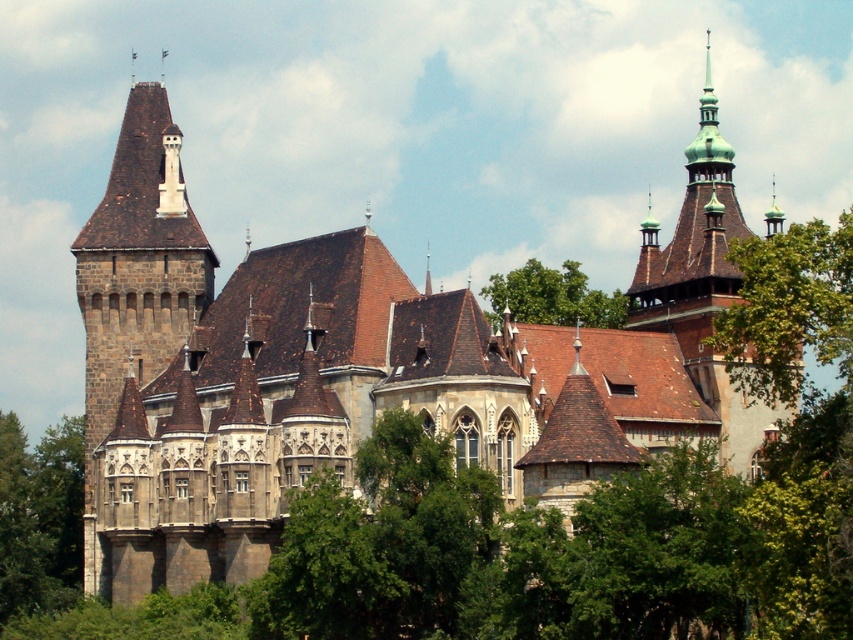
Question: Which object is positioned farthest from the green leafy tree at lower left?

Choices:
 (A) green leafy tree at upper right
 (B) dark brown stone tower at left
 (C) green leafy tree at upper center

Answer: (A)

Question: Is green leafy tree at upper right positioned before green leafy tree at lower left?

Choices:
 (A) yes
 (B) no

Answer: (A)

Question: Does dark brown stone tower at left appear over green copper spire at upper right?

Choices:
 (A) no
 (B) yes

Answer: (A)

Question: Which point is closer to the camera?

Choices:
 (A) green leafy tree at upper right
 (B) green copper spire at upper right

Answer: (A)

Question: Among these points, which one is farthest from the camera?

Choices:
 (A) (38, 568)
 (B) (595, 321)
 (C) (732, 154)

Answer: (B)

Question: Can you confirm if green copper spire at upper right is positioned above green leafy tree at upper center?

Choices:
 (A) no
 (B) yes

Answer: (B)